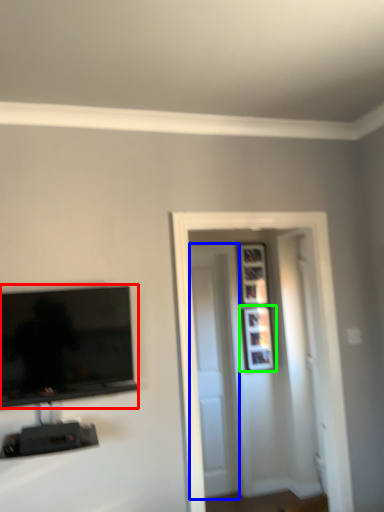
Question: Which object is positioned closest to television (highlighted by a red box)? Select from door (highlighted by a blue box) and picture frame (highlighted by a green box).

Choices:
 (A) door
 (B) picture frame

Answer: (A)